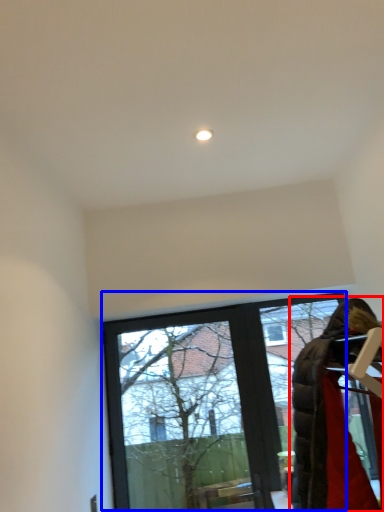
Question: Which of the following is the closest to the observer, woman (highlighted by a red box) or window (highlighted by a blue box)?

Choices:
 (A) woman
 (B) window

Answer: (A)